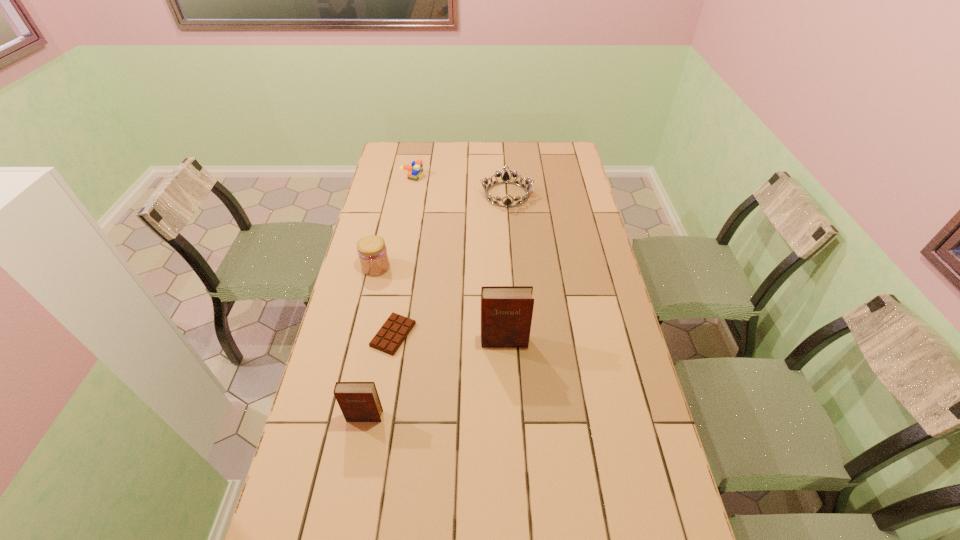
This screenshot has width=960, height=540. Find the location of `vacant space located on the front cover of the taller diary`. vacant space located on the front cover of the taller diary is located at coordinates (510, 471).

You are a GUI agent. You are given a task and a screenshot of the screen. Output one action in this format:
    pyautogui.click(x=<x>, y=<y>)
    Task: Click on the vacant space located 0.160m on the front of the Lego
    This screenshot has height=540, width=960.
    Given the screenshot: What is the action you would take?
    pyautogui.click(x=405, y=203)

Locate an element on the screen. This screenshot has height=540, width=960. vacant space located on the front-facing side of the tiara is located at coordinates (510, 233).

At what (x,y) coordinates should I click in order to perform the action: click on free location located on the front of the fourth shortest object. Please return your answer as a coordinate pair (x, y). This screenshot has width=960, height=540. Looking at the image, I should click on [352, 368].

You are a GUI agent. You are given a task and a screenshot of the screen. Output one action in this format:
    pyautogui.click(x=<x>, y=<y>)
    Task: Click on the free space located on the back of the shortest object
    The height and width of the screenshot is (540, 960).
    Given the screenshot: What is the action you would take?
    pyautogui.click(x=406, y=256)

The width and height of the screenshot is (960, 540). I want to click on object at the far edge, so click(x=414, y=171).

I want to click on diary located in the left edge section of the desktop, so click(x=359, y=401).

The image size is (960, 540). I want to click on Lego present at the left edge, so click(414, 171).

Image resolution: width=960 pixels, height=540 pixels. I want to click on jam that is at the left edge, so click(x=372, y=252).

Find the location of `candy bar present at the left edge`. candy bar present at the left edge is located at coordinates (391, 335).